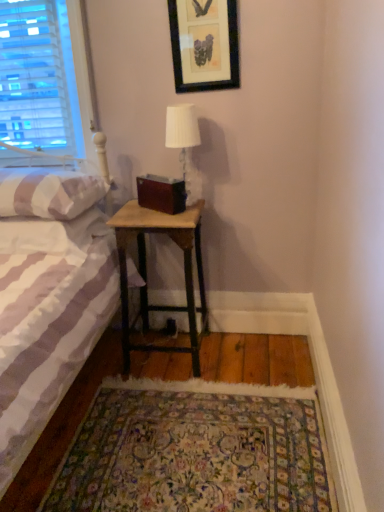
The width and height of the screenshot is (384, 512). I want to click on unoccupied area in front of woodenmaterial/texturenightstand at lower center, so click(x=176, y=398).